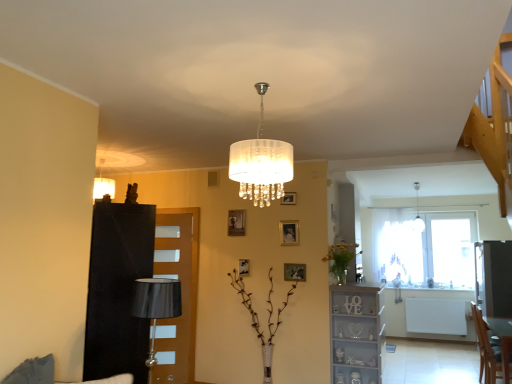
How much space does translucent glass vase at center, arranged as the 1th plant when viewed from the right, occupy horizontally?

17.07 inches.

Where is `wooden photo frame at center, arranged as the 1th picture frame when viewed from the left`? The height and width of the screenshot is (384, 512). wooden photo frame at center, arranged as the 1th picture frame when viewed from the left is located at coordinates pyautogui.click(x=236, y=222).

Describe the element at coordinates (236, 222) in the screenshot. I see `wooden photo frame at center, the fourth picture frame in the bottom-to-top sequence` at that location.

What do you see at coordinates (354, 335) in the screenshot? The height and width of the screenshot is (384, 512). I see `white wood shelf at lower right` at bounding box center [354, 335].

The height and width of the screenshot is (384, 512). In order to click on brown textured plant at center, the 2th plant positioned from the right in this screenshot , I will do `click(258, 319)`.

Find the location of a particular element. This screenshot has width=512, height=384. gold metallic picture frame at center, acting as the 1th picture frame starting from the bottom is located at coordinates (294, 272).

Describe the element at coordinates (294, 272) in the screenshot. The width and height of the screenshot is (512, 384). I see `gold metallic picture frame at center, the 5th picture frame positioned from the left` at that location.

Where is `matte gold picture frame at center, which ranks as the 2th picture frame in right-to-left order`? This screenshot has height=384, width=512. matte gold picture frame at center, which ranks as the 2th picture frame in right-to-left order is located at coordinates (289, 232).

Considering the sizes of brown textured plant at center, the 2th plant positioned from the right, and wooden photo frame at center, positioned as the second picture frame in top-to-bottom order, in the image, is brown textured plant at center, the 2th plant positioned from the right, wider or thinner than wooden photo frame at center, positioned as the second picture frame in top-to-bottom order,?

In the image, brown textured plant at center, the 2th plant positioned from the right, appears to be wider than wooden photo frame at center, positioned as the second picture frame in top-to-bottom order.

Considering the positions of point (241, 278) and point (236, 227), is point (241, 278) closer or farther from the camera than point (236, 227)?

Point (241, 278) appears to be closer to the viewer than point (236, 227).

Who is smaller, brown textured plant at center, the 2th plant positioned from the right, or wooden photo frame at center, arranged as the 1th picture frame when viewed from the left?

Smaller between the two is wooden photo frame at center, arranged as the 1th picture frame when viewed from the left.

Are brown textured plant at center, which appears as the 1th plant when viewed from the left, and wooden photo frame at center, positioned as the second picture frame in top-to-bottom order, far apart?

Absolutely, brown textured plant at center, which appears as the 1th plant when viewed from the left, is distant from wooden photo frame at center, positioned as the second picture frame in top-to-bottom order.

Can you tell me how much gold metallic picture frame at center, which is the fifth picture frame from top to bottom, and metallic gold picture frame at center, the 2th picture frame in the left-to-right sequence, differ in facing direction?

There is a 0.00126-degree angle between the facing directions of gold metallic picture frame at center, which is the fifth picture frame from top to bottom, and metallic gold picture frame at center, the 2th picture frame in the left-to-right sequence.

The image size is (512, 384). I want to click on the 3rd picture frame to the left of the gold metallic picture frame at center, which is the fifth picture frame from top to bottom, counting from the anchor's position, so click(x=244, y=267).

In terms of width, does gold metallic picture frame at center, acting as the 1th picture frame starting from the bottom, look wider or thinner when compared to metallic gold picture frame at center, the 2th picture frame in the left-to-right sequence?

gold metallic picture frame at center, acting as the 1th picture frame starting from the bottom, is wider than metallic gold picture frame at center, the 2th picture frame in the left-to-right sequence.

Can you confirm if gold metallic picture frame at center, acting as the 1th picture frame starting from the bottom, is smaller than metallic gold picture frame at center, positioned as the 4th picture frame in right-to-left order?

No.

Is brown textured plant at center, which appears as the 1th plant when viewed from the left, facing towards brown leather armchair at lower right?

No.

Who is taller, brown textured plant at center, the 2th plant positioned from the right, or brown leather armchair at lower right?

With more height is brown textured plant at center, the 2th plant positioned from the right.

Is the surface of brown textured plant at center, the 2th plant positioned from the right, in direct contact with brown leather armchair at lower right?

No, brown textured plant at center, the 2th plant positioned from the right, is not next to brown leather armchair at lower right.

Can you confirm if brown textured plant at center, the 2th plant positioned from the right, is bigger than brown leather armchair at lower right?

Indeed, brown textured plant at center, the 2th plant positioned from the right, has a larger size compared to brown leather armchair at lower right.

Considering the points (288, 235) and (346, 370), which point is behind, point (288, 235) or point (346, 370)?

Positioned behind is point (288, 235).

Considering the relative positions of matte gold picture frame at center, which is counted as the 3th picture frame, starting from the bottom, and white wood shelf at lower right in the image provided, is matte gold picture frame at center, which is counted as the 3th picture frame, starting from the bottom, to the left of white wood shelf at lower right from the viewer's perspective?

Correct, you'll find matte gold picture frame at center, which is counted as the 3th picture frame, starting from the bottom, to the left of white wood shelf at lower right.

Considering the sizes of matte gold picture frame at center, which is counted as the 3th picture frame, starting from the bottom, and white wood shelf at lower right in the image, is matte gold picture frame at center, which is counted as the 3th picture frame, starting from the bottom, wider or thinner than white wood shelf at lower right?

Clearly, matte gold picture frame at center, which is counted as the 3th picture frame, starting from the bottom, has less width compared to white wood shelf at lower right.

Are metallic gold picture frame at center, the 2th picture frame in the left-to-right sequence, and white crystal chandelier at center, which appears as the second lamp when viewed from the right, located far from each other?

Yes, metallic gold picture frame at center, the 2th picture frame in the left-to-right sequence, and white crystal chandelier at center, which appears as the second lamp when viewed from the right, are quite far apart.

Consider the image. From the image's perspective, is metallic gold picture frame at center, acting as the 4th picture frame starting from the top, positioned above or below white crystal chandelier at center, which appears as the second lamp when viewed from the right?

metallic gold picture frame at center, acting as the 4th picture frame starting from the top, is below white crystal chandelier at center, which appears as the second lamp when viewed from the right.

Who is more distant, metallic gold picture frame at center, the 2th picture frame in the left-to-right sequence, or white crystal chandelier at center, which ranks as the 2th lamp in back-to-front order?

metallic gold picture frame at center, the 2th picture frame in the left-to-right sequence, is behind.

How many degrees apart are the facing directions of metallic gold picture frame at center, the second picture frame when ordered from bottom to top, and white crystal chandelier at center, which appears as the second lamp when viewed from the right?

The angular difference between metallic gold picture frame at center, the second picture frame when ordered from bottom to top, and white crystal chandelier at center, which appears as the second lamp when viewed from the right, is 91.4 degrees.

Is brown wooden door at left looking in the opposite direction of translucent glass vase at center, arranged as the 1th plant when viewed from the right?

That's not correct — brown wooden door at left is not looking away from translucent glass vase at center, arranged as the 1th plant when viewed from the right.

Considering the sizes of objects brown wooden door at left and translucent glass vase at center, arranged as the 1th plant when viewed from the right, in the image provided, who is shorter, brown wooden door at left or translucent glass vase at center, arranged as the 1th plant when viewed from the right,?

translucent glass vase at center, arranged as the 1th plant when viewed from the right.

Where is `plant that appears above the brown wooden door at left (from a real-world perspective)`? The width and height of the screenshot is (512, 384). plant that appears above the brown wooden door at left (from a real-world perspective) is located at coordinates (340, 259).

Which point is more forward, (234, 221) or (492, 368)?

The point (492, 368) is closer.

This screenshot has width=512, height=384. What are the coordinates of `the 5th picture frame counting from the left of the brown leather armchair at lower right` in the screenshot? It's located at (236, 222).

Considering the sizes of objects wooden photo frame at center, placed as the fifth picture frame when sorted from right to left, and brown leather armchair at lower right in the image provided, who is smaller, wooden photo frame at center, placed as the fifth picture frame when sorted from right to left, or brown leather armchair at lower right?

With smaller size is wooden photo frame at center, placed as the fifth picture frame when sorted from right to left.

How many degrees apart are the facing directions of wooden photo frame at center, positioned as the second picture frame in top-to-bottom order, and brown leather armchair at lower right?

The facing directions of wooden photo frame at center, positioned as the second picture frame in top-to-bottom order, and brown leather armchair at lower right are 89.5 degrees apart.

From a real-world perspective, which plant is the 2nd one underneath the wooden photo frame at center, positioned as the second picture frame in top-to-bottom order? Please provide its 2D coordinates.

[(258, 319)]

From the image's perspective, count 1st picture frames upward from the gold metallic picture frame at center, the 5th picture frame positioned from the left, and point to it. Please provide its 2D coordinates.

[(244, 267)]

Considering their positions, is wooden photo frame at center, the fourth picture frame in the bottom-to-top sequence, positioned further to black leather dresser at left than matte gold picture frame at center, positioned as the 4th picture frame in left-to-right order?

wooden photo frame at center, the fourth picture frame in the bottom-to-top sequence, is positioned further to the anchor black leather dresser at left.

Considering their positions, is matte gold picture frame at center, which ranks as the 2th picture frame in right-to-left order, positioned further to wooden photo frame at center, placed as the fifth picture frame when sorted from right to left, than gold metallic picture frame at center, the first picture frame in the right-to-left sequence?

The object further to wooden photo frame at center, placed as the fifth picture frame when sorted from right to left, is gold metallic picture frame at center, the first picture frame in the right-to-left sequence.

Considering their positions, is translucent glass vase at center, which is the second plant in left-to-right order, positioned closer to white wood shelf at lower right than gold metallic picture frame at center, the 5th picture frame positioned from the left?

translucent glass vase at center, which is the second plant in left-to-right order, lies closer to white wood shelf at lower right than the other object.

Looking at the image, which one is located further to white glass pendant light at upper right, the 1th lamp when ordered from right to left, white wood shelf at lower right or wooden table at lower right?

Among the two, white wood shelf at lower right is located further to white glass pendant light at upper right, the 1th lamp when ordered from right to left.

From the image, which object appears to be farther from wooden table at lower right, white wood shelf at lower right or brown textured plant at center, the 2th plant positioned from the right?

brown textured plant at center, the 2th plant positioned from the right, lies further to wooden table at lower right than the other object.

In the scene shown: From the image, which object appears to be nearer to wooden photo frame at center, arranged as the 1th picture frame when viewed from the left, white glass pendant light at upper right, the 2th lamp positioned from the front, or transparent glass window at upper right?

white glass pendant light at upper right, the 2th lamp positioned from the front, lies closer to wooden photo frame at center, arranged as the 1th picture frame when viewed from the left, than the other object.

Which object lies nearer to the anchor point gold metallic picture frame at upper center, the first picture frame in the top-to-bottom sequence, matte gold picture frame at center, which ranks as the third picture frame in top-to-bottom order, or translucent glass vase at center, which is the second plant in left-to-right order?

Based on the image, matte gold picture frame at center, which ranks as the third picture frame in top-to-bottom order, appears to be nearer to gold metallic picture frame at upper center, the first picture frame in the top-to-bottom sequence.

Estimate the real-world distances between objects in this image. Which object is closer to transparent glass window at upper right, brown wooden door at left or black leather dresser at left?

brown wooden door at left is closer to transparent glass window at upper right.

Where is `dresser between white crystal chandelier at center, marked as the first lamp in a left-to-right arrangement, and transparent glass window at upper right in the front-back direction`? dresser between white crystal chandelier at center, marked as the first lamp in a left-to-right arrangement, and transparent glass window at upper right in the front-back direction is located at coordinates (118, 290).

Identify the location of armchair between black leather dresser at left and transparent glass window at upper right. This screenshot has width=512, height=384. (486, 350).

Where is `plant between gold metallic picture frame at upper center, the first picture frame in the top-to-bottom sequence, and gold metallic picture frame at center, the first picture frame in the right-to-left sequence, vertically`? The height and width of the screenshot is (384, 512). plant between gold metallic picture frame at upper center, the first picture frame in the top-to-bottom sequence, and gold metallic picture frame at center, the first picture frame in the right-to-left sequence, vertically is located at coordinates (340, 259).

Locate an element on the screen. The image size is (512, 384). armchair situated between brown textured plant at center, which appears as the 1th plant when viewed from the left, and wooden table at lower right from left to right is located at coordinates (486, 350).